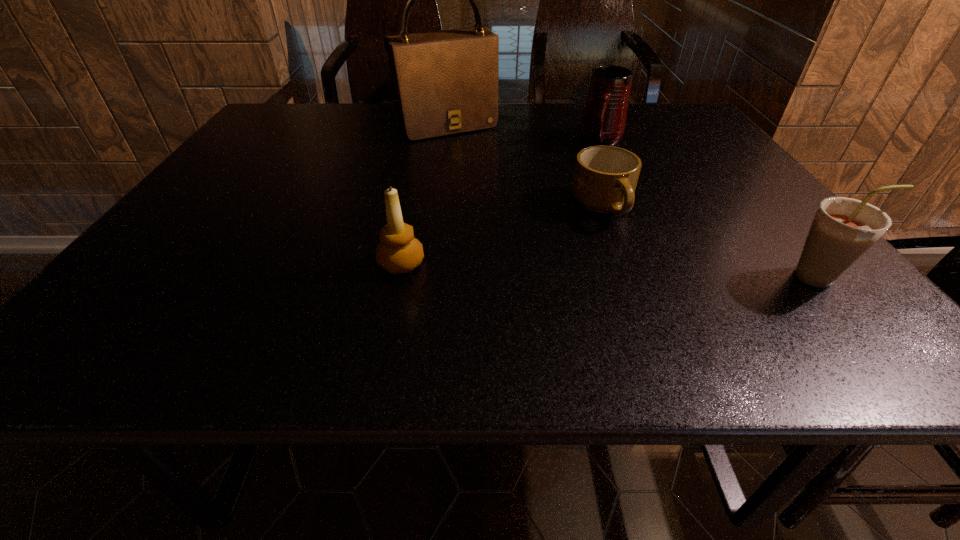
At what (x,y) coordinates should I click in order to perform the action: click on object that is at the near right corner. Please return your answer as a coordinate pair (x, y). Looking at the image, I should click on (844, 229).

Locate an element on the screen. This screenshot has width=960, height=540. vacant area at the far edge is located at coordinates (554, 104).

Where is `vacant region at the near edge of the desktop`? This screenshot has height=540, width=960. vacant region at the near edge of the desktop is located at coordinates (360, 273).

You are a GUI agent. You are given a task and a screenshot of the screen. Output one action in this format:
    pyautogui.click(x=<x>, y=<y>)
    Task: Click on the vacant space at the left edge of the desktop
    The width and height of the screenshot is (960, 540).
    Given the screenshot: What is the action you would take?
    pyautogui.click(x=185, y=210)

Locate an element on the screen. The height and width of the screenshot is (540, 960). free space at the right edge of the desktop is located at coordinates (713, 204).

Identify the location of free space at the far left corner of the desktop. (277, 122).

Where is `empty space between the candle_holder and the tallest object`? The width and height of the screenshot is (960, 540). empty space between the candle_holder and the tallest object is located at coordinates (424, 195).

This screenshot has width=960, height=540. I want to click on empty location between the taller mug and the candle_holder, so click(501, 202).

Locate an element on the screen. free spot between the shoulder bag and the farther mug is located at coordinates (524, 133).

Locate an element on the screen. The height and width of the screenshot is (540, 960). free space between the farther mug and the candle_holder is located at coordinates (501, 202).